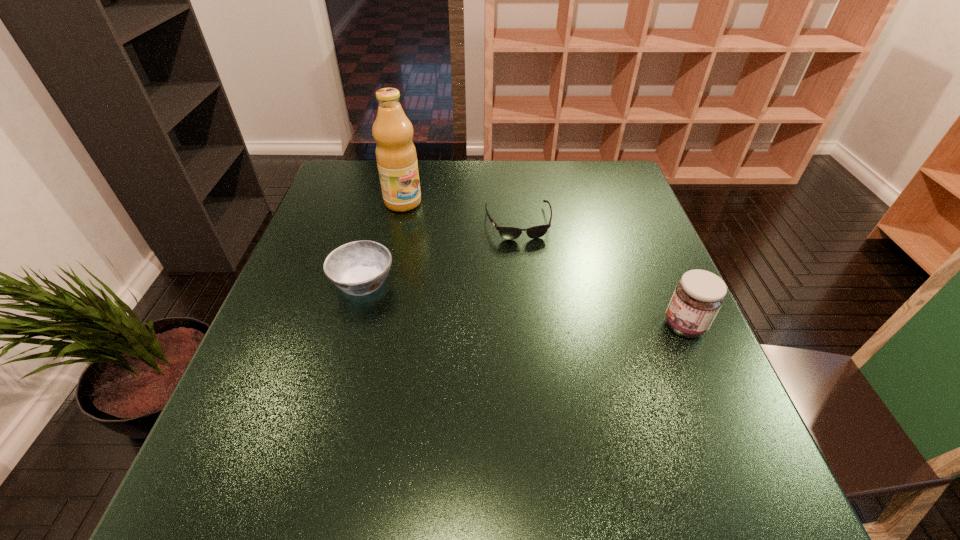
Where is `vacant area situated on the front label of the second tallest object`? The width and height of the screenshot is (960, 540). vacant area situated on the front label of the second tallest object is located at coordinates (523, 326).

Where is `vacant space located 0.280m on the label of the tallest object`? vacant space located 0.280m on the label of the tallest object is located at coordinates (476, 262).

The height and width of the screenshot is (540, 960). What are the coordinates of `vacant space located on the label of the tallest object` in the screenshot? It's located at (492, 275).

The width and height of the screenshot is (960, 540). What are the coordinates of `vacant space located 0.220m on the label of the tallest object` in the screenshot? It's located at (461, 249).

At what (x,y) coordinates should I click in order to perform the action: click on vacant space located on the front-facing side of the second object from right to left. Please return your answer as a coordinate pair (x, y). The image size is (960, 540). Looking at the image, I should click on (551, 359).

The width and height of the screenshot is (960, 540). What are the coordinates of `vacant space located on the front-facing side of the second object from right to left` in the screenshot? It's located at (531, 273).

At what (x,y) coordinates should I click in order to perform the action: click on free space located 0.110m on the front-facing side of the second object from right to left. Please return your answer as a coordinate pair (x, y). Looking at the image, I should click on (530, 271).

Locate an element on the screen. object at the far edge is located at coordinates (396, 156).

Find the location of `object situated at the left edge`. object situated at the left edge is located at coordinates (358, 268).

Where is `object that is at the right edge`? object that is at the right edge is located at coordinates (698, 296).